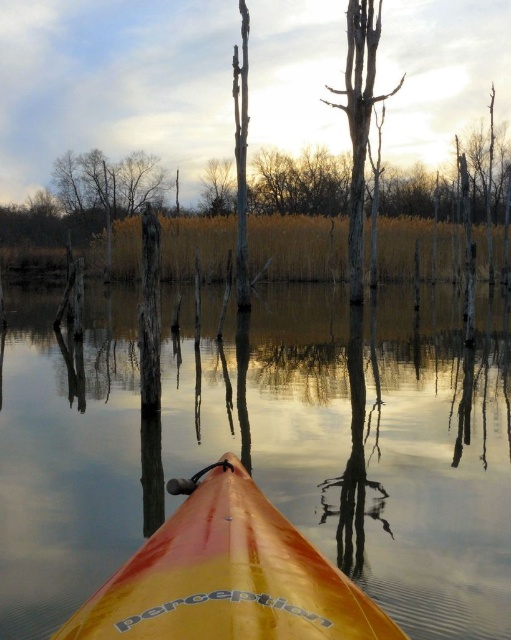
You are a photographer trying to capture the reflection of the yellow glossy kayak at center and the bare wood tree at center in the water. Since the water is still, you know that reflections are mirrored. Based on their positions, which object do you think will appear on the right side of its reflection?

The yellow glossy kayak at center is to the left of the bare wood tree at center, so in the reflection, the kayak will appear on the right side of the tree, making the yellow glossy kayak at center the object that appears on the right side of its reflection.

Looking at this image, you are navigating a kayak and want to avoid hitting the bare wood tree at center. Based on its position, which direction should you steer the kayak to stay clear of it?

The bare wood tree at center is located at point [359,120], so steering the kayak away from that coordinate will help avoid it.